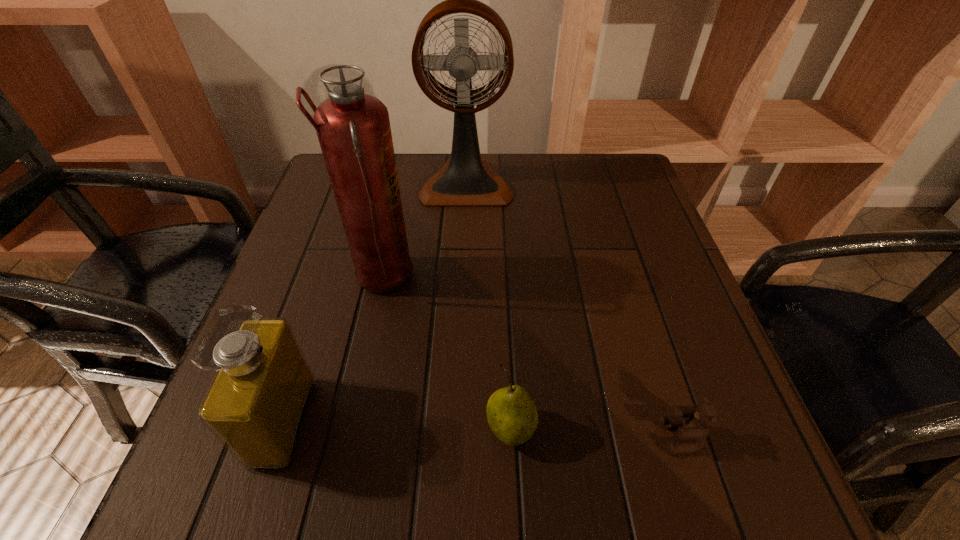
Identify the location of object at the right edge. (695, 429).

At what (x,y) coordinates should I click in order to perform the action: click on object situated at the near left corner. Please return your answer as a coordinate pair (x, y). Looking at the image, I should click on (256, 404).

Where is `object that is at the near right corner`? Image resolution: width=960 pixels, height=540 pixels. object that is at the near right corner is located at coordinates (695, 429).

The width and height of the screenshot is (960, 540). In the image, there is a desktop. What are the coordinates of `free space at the far edge` in the screenshot? It's located at (564, 187).

You are a GUI agent. You are given a task and a screenshot of the screen. Output one action in this format:
    pyautogui.click(x=<x>, y=<y>)
    Task: Click on the blank space at the near edge
    This screenshot has width=960, height=540.
    Given the screenshot: What is the action you would take?
    pyautogui.click(x=557, y=450)

The height and width of the screenshot is (540, 960). Find the location of `free space at the left edge of the desktop`. free space at the left edge of the desktop is located at coordinates (353, 268).

Image resolution: width=960 pixels, height=540 pixels. In the image, there is a desktop. Identify the location of blank space at the right edge. (656, 242).

In the image, there is a desktop. Find the location of `free region at the far right corner`. free region at the far right corner is located at coordinates (632, 167).

Identify the location of vacant area that lies between the third tallest object and the second farthest object. The width and height of the screenshot is (960, 540). (333, 350).

The height and width of the screenshot is (540, 960). What are the coordinates of `vacant area between the farthest object and the fire extinguisher` in the screenshot? It's located at (423, 231).